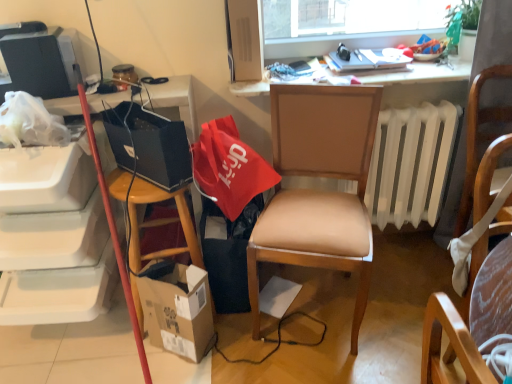
This screenshot has width=512, height=384. I want to click on vacant area situated below light brown leather chair at center, which is counted as the second chair, starting from the right (from a real-world perspective), so click(x=313, y=307).